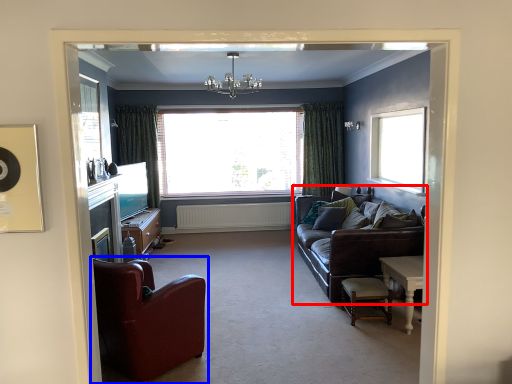
Question: Which point is closer to the camera, studio couch (highlighted by a red box) or chair (highlighted by a blue box)?

Choices:
 (A) studio couch
 (B) chair

Answer: (B)